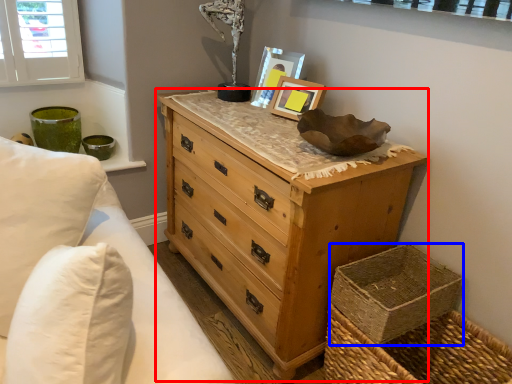
Question: Which of the following is the farthest to the observer, chest of drawers (highlighted by a red box) or basket container (highlighted by a blue box)?

Choices:
 (A) chest of drawers
 (B) basket container

Answer: (B)